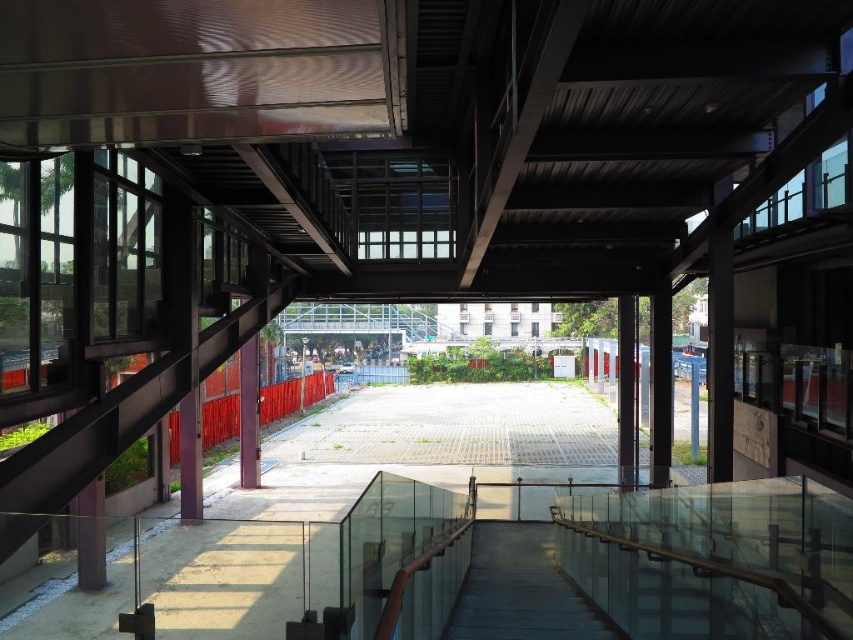
Question: In this image, where is transparent glass walkway at center located relative to smooth concrete stairs at center?

Choices:
 (A) right
 (B) left

Answer: (B)

Question: Which object appears closest to the camera in this image?

Choices:
 (A) transparent glass walkway at center
 (B) smooth concrete stairs at center

Answer: (A)

Question: Among these points, which one is nearest to the camera?

Choices:
 (A) (473, 556)
 (B) (172, 593)

Answer: (B)

Question: Does transparent glass walkway at center appear on the left side of smooth concrete stairs at center?

Choices:
 (A) yes
 (B) no

Answer: (A)

Question: Can you confirm if transparent glass walkway at center is bigger than smooth concrete stairs at center?

Choices:
 (A) yes
 (B) no

Answer: (A)